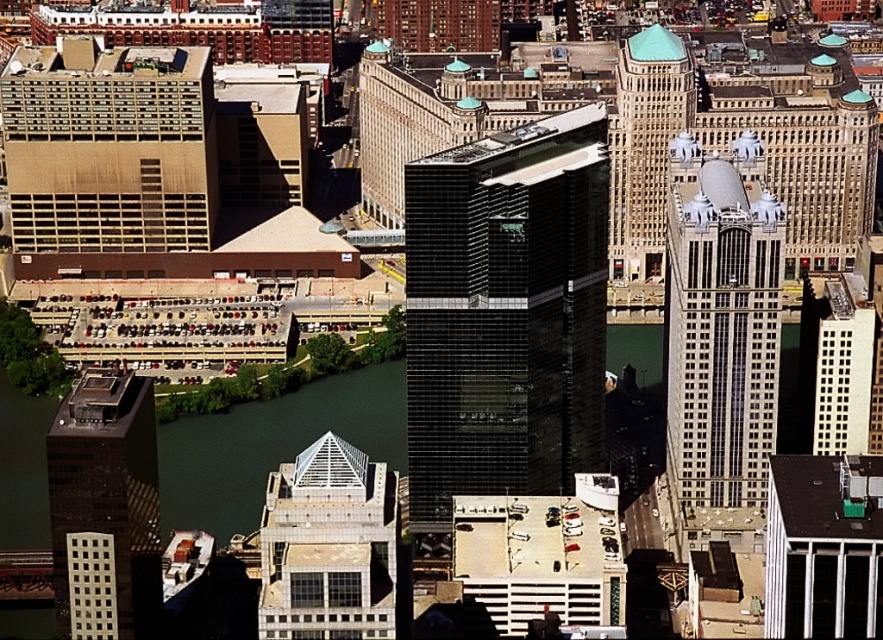
Question: Does black glass skyscraper at center have a lesser width compared to dark glass building at left?

Choices:
 (A) no
 (B) yes

Answer: (A)

Question: Which point is closer to the camera?

Choices:
 (A) dark glass building at left
 (B) brown textured building at left

Answer: (B)

Question: Considering the relative positions of black glass skyscraper at center and dark glass building at left in the image provided, where is black glass skyscraper at center located with respect to dark glass building at left?

Choices:
 (A) below
 (B) above

Answer: (B)

Question: Considering the relative positions of brown textured building at left and glass pyramid at center in the image provided, where is brown textured building at left located with respect to glass pyramid at center?

Choices:
 (A) right
 (B) left

Answer: (B)

Question: Based on their relative distances, which object is farther from the glass pyramid at center?

Choices:
 (A) dark glass building at left
 (B) white glass building at center-right
 (C) matte glass skyscraper at upper right
 (D) white glass skyscraper at upper right

Answer: (B)

Question: Which point is farther to the camera?

Choices:
 (A) glass pyramid at center
 (B) white glass skyscraper at upper right

Answer: (B)